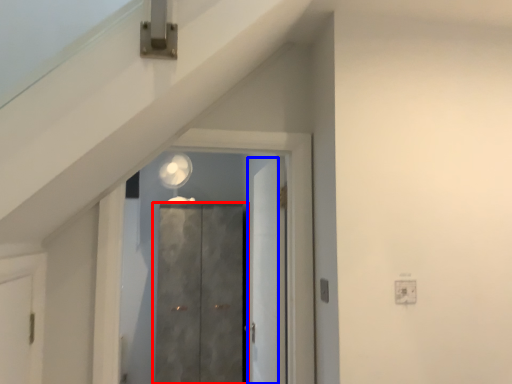
Question: Which object appears closest to the camera in this image, door (highlighted by a red box) or door (highlighted by a blue box)?

Choices:
 (A) door
 (B) door

Answer: (B)